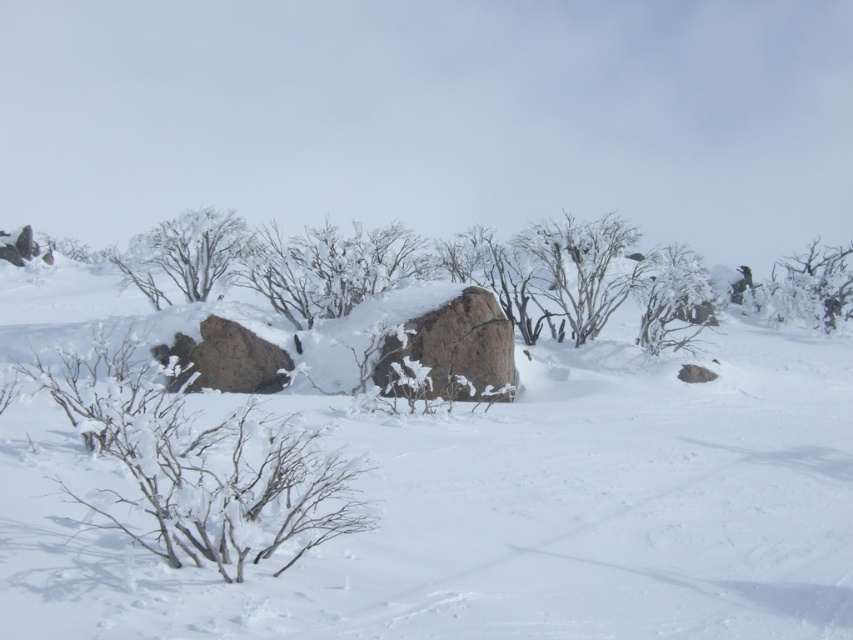
Question: Which object appears closest to the camera in this image?

Choices:
 (A) white snow-covered shrub at center
 (B) white frosty shrub at upper center

Answer: (A)

Question: Is white fluffy snow at center closer to camera compared to snow-covered shrub at right?

Choices:
 (A) no
 (B) yes

Answer: (B)

Question: Is white fluffy snow at center behind snow-covered branches at lower left?

Choices:
 (A) no
 (B) yes

Answer: (A)

Question: From the image, what is the correct spatial relationship of brown rough boulder at center in relation to snow-covered branches at center?

Choices:
 (A) below
 (B) above

Answer: (A)

Question: Which of the following is the closest to the observer?

Choices:
 (A) (648, 296)
 (B) (442, 353)
 (C) (601, 259)

Answer: (B)

Question: Among these objects, which one is farthest from the camera?

Choices:
 (A) white fluffy snow at center
 (B) white frosty shrub at upper center
 (C) white snow-covered shrub at center
 (D) snow-covered shrub at right

Answer: (D)